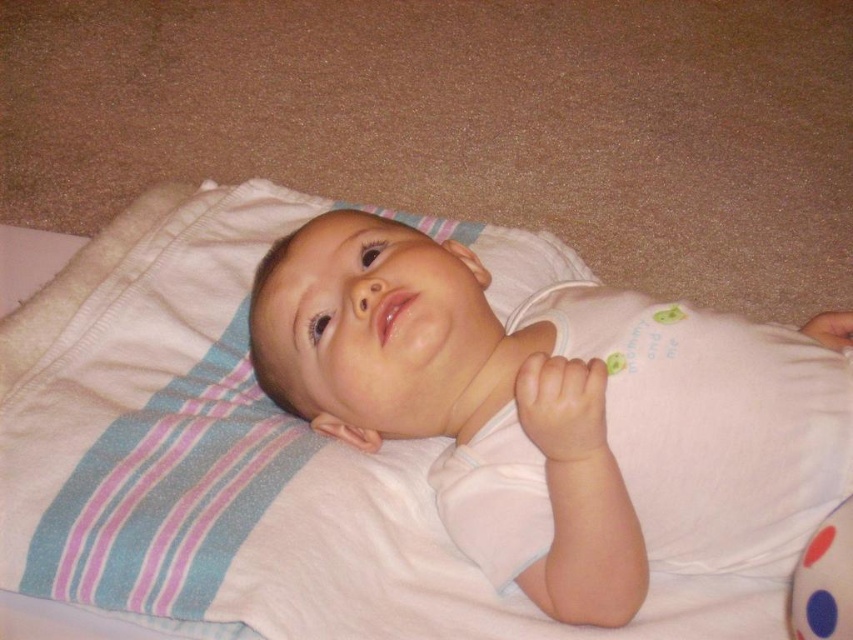
Question: Where is white soft pillow at upper center located in relation to polka dot fabric ball at lower right in the image?

Choices:
 (A) left
 (B) right

Answer: (A)

Question: Which object appears farthest from the camera in this image?

Choices:
 (A) white soft pillow at upper center
 (B) polka dot fabric ball at lower right
 (C) white soft baby at center

Answer: (C)

Question: Among these points, which one is farthest from the camera?

Choices:
 (A) (444, 344)
 (B) (799, 570)
 (C) (120, 492)

Answer: (C)

Question: Which object is closer to the camera taking this photo?

Choices:
 (A) white soft baby at center
 (B) white soft pillow at upper center

Answer: (B)

Question: Is white soft baby at center wider than polka dot fabric ball at lower right?

Choices:
 (A) yes
 (B) no

Answer: (A)

Question: In this image, where is white soft baby at center located relative to polka dot fabric ball at lower right?

Choices:
 (A) right
 (B) left

Answer: (B)